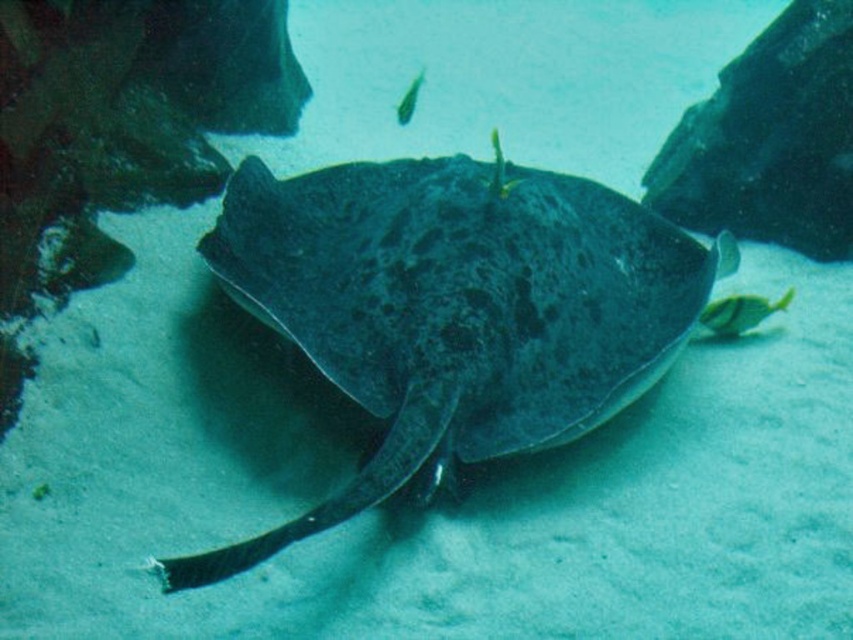
Who is more distant from viewer, (601, 202) or (718, 320)?

Point (601, 202)

Can you confirm if dark gray textured stingray at center is positioned to the left of shiny yellow fish at center?

Yes, dark gray textured stingray at center is to the left of shiny yellow fish at center.

The image size is (853, 640). I want to click on dark gray textured stingray at center, so click(453, 310).

Does shiny yellow fish at center have a larger size compared to green glossy fish at upper center?

Incorrect, shiny yellow fish at center is not larger than green glossy fish at upper center.

The image size is (853, 640). Describe the element at coordinates (740, 312) in the screenshot. I see `shiny yellow fish at center` at that location.

Where is `shiny yellow fish at center`? shiny yellow fish at center is located at coordinates (740, 312).

Which is below, dark gray textured stingray at center or green glossy fish at upper center?

dark gray textured stingray at center

Can you confirm if dark gray textured stingray at center is wider than green glossy fish at upper center?

Correct, the width of dark gray textured stingray at center exceeds that of green glossy fish at upper center.

Is point (572, 422) positioned in front of point (410, 108)?

Yes, it is in front of point (410, 108).

This screenshot has width=853, height=640. I want to click on dark gray textured stingray at center, so click(x=453, y=310).